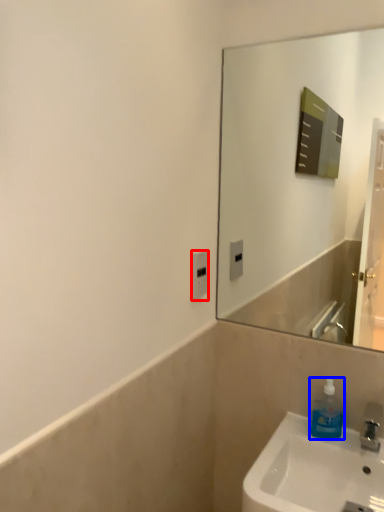
Question: Which object is further to the camera taking this photo, electric outlet (highlighted by a red box) or soap dispenser (highlighted by a blue box)?

Choices:
 (A) electric outlet
 (B) soap dispenser

Answer: (A)